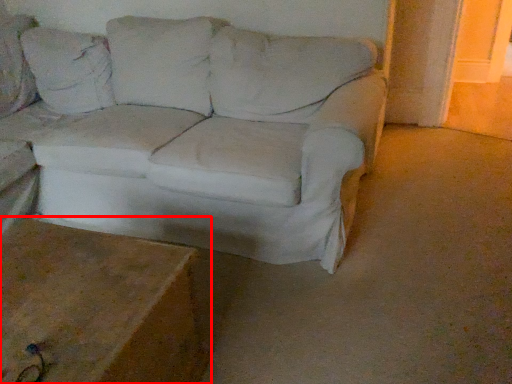
Question: Where is table (annotated by the red box) located in relation to studio couch in the image?

Choices:
 (A) left
 (B) right

Answer: (A)